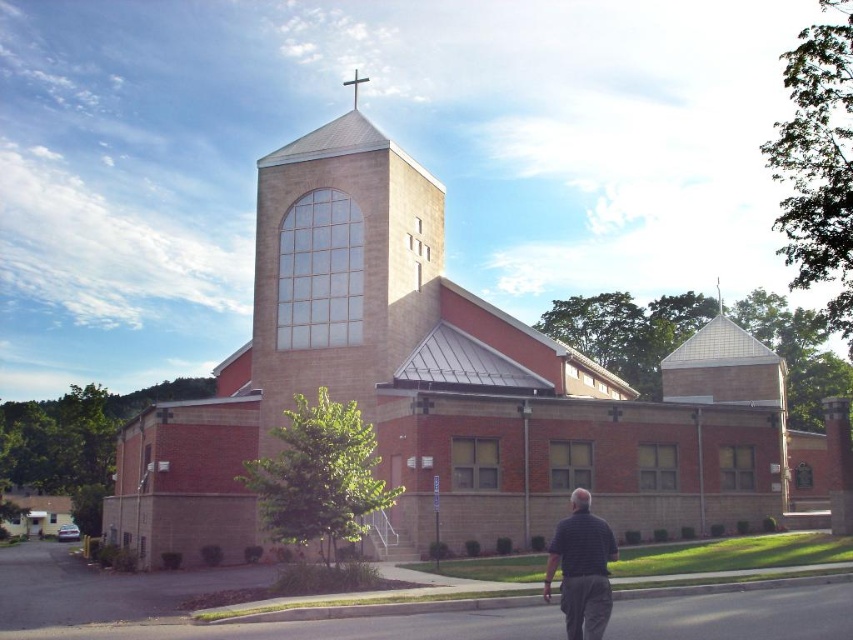
You are standing in front of the church and see the brick church at center and the striped shirt at lower right. Which object is bigger in size?

The brick church at center is larger in size compared to the striped shirt at lower right.

You are standing in a park and see the brick church at center and the striped shirt at lower right. Which object is more to the left?

The striped shirt at lower right is more to the left because the brick church at center is positioned on the right side of striped shirt at lower right.